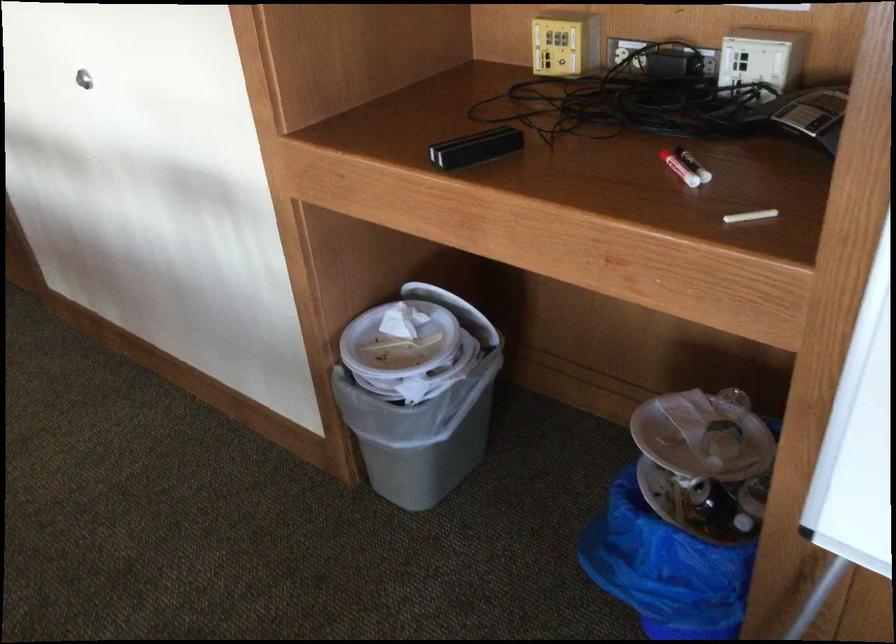
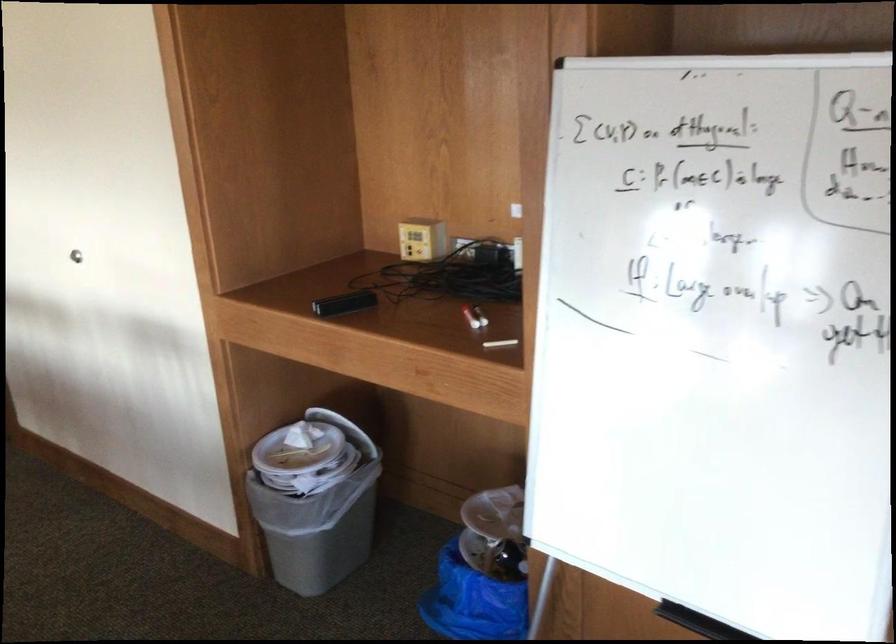
In the second image, find the point that corresponds to pixel 431 375 in the first image.

(315, 475)